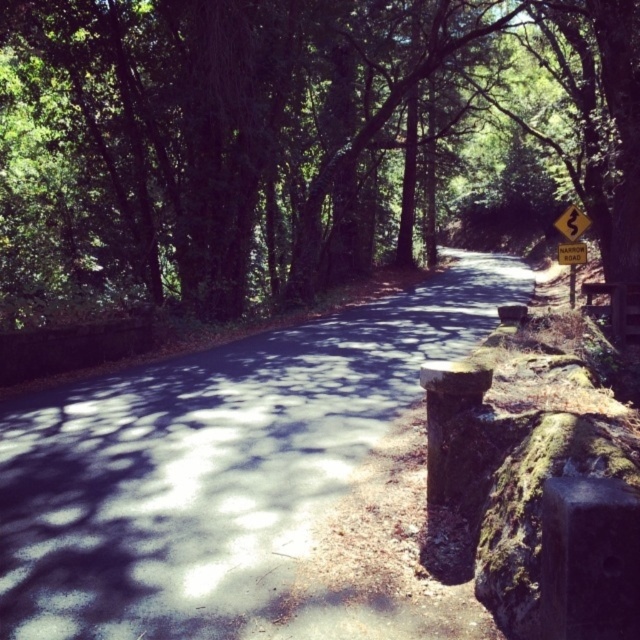
Is point (554, 224) behind point (586, 256)?

Yes, point (554, 224) is farther from viewer.

Looking at this image, who is more forward, [579,234] or [573,262]?

Point [573,262] is in front.

Locate an element on the screen. This screenshot has height=640, width=640. yellow reflective plastic road sign at upper right is located at coordinates (572, 221).

Which is in front, point (298, 33) or point (570, 259)?

Point (570, 259) is more forward.

Which is more to the right, green leafy tree at upper center or yellow paper sign at upper right?

yellow paper sign at upper right is more to the right.

Is point (492, 40) behind point (579, 250)?

Yes, it is.

At what (x,y) coordinates should I click in order to perform the action: click on green leafy tree at upper center. Please return your answer as a coordinate pair (x, y). The image size is (640, 640). Looking at the image, I should click on (296, 140).

Who is higher up, yellow paper sign at upper right or yellow reflective plastic road sign at upper right?

Positioned higher is yellow reflective plastic road sign at upper right.

What do you see at coordinates (572, 243) in the screenshot?
I see `yellow paper sign at upper right` at bounding box center [572, 243].

The image size is (640, 640). In order to click on yellow paper sign at upper right in this screenshot , I will do `click(572, 243)`.